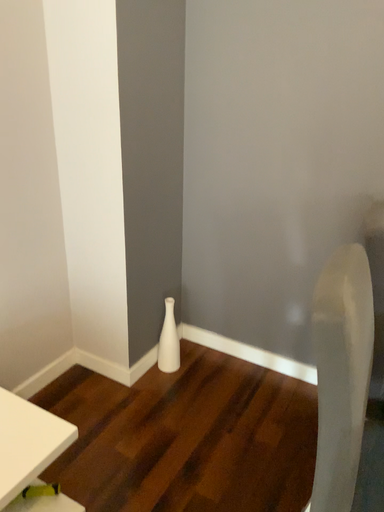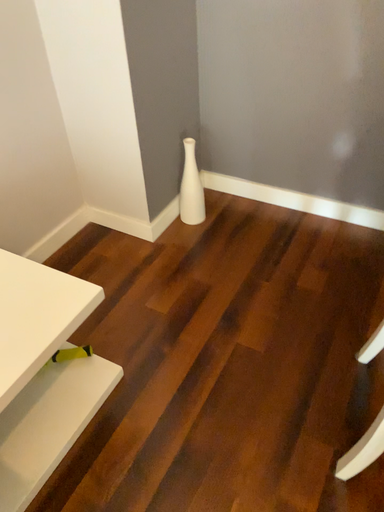
Question: How did the camera likely rotate when shooting the video?

Choices:
 (A) rotated upward
 (B) rotated downward

Answer: (B)